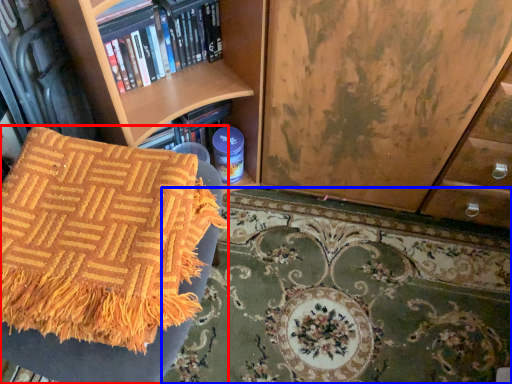
Question: Among these objects, which one is farthest to the camera, furniture (highlighted by a red box) or mat (highlighted by a blue box)?

Choices:
 (A) furniture
 (B) mat

Answer: (B)